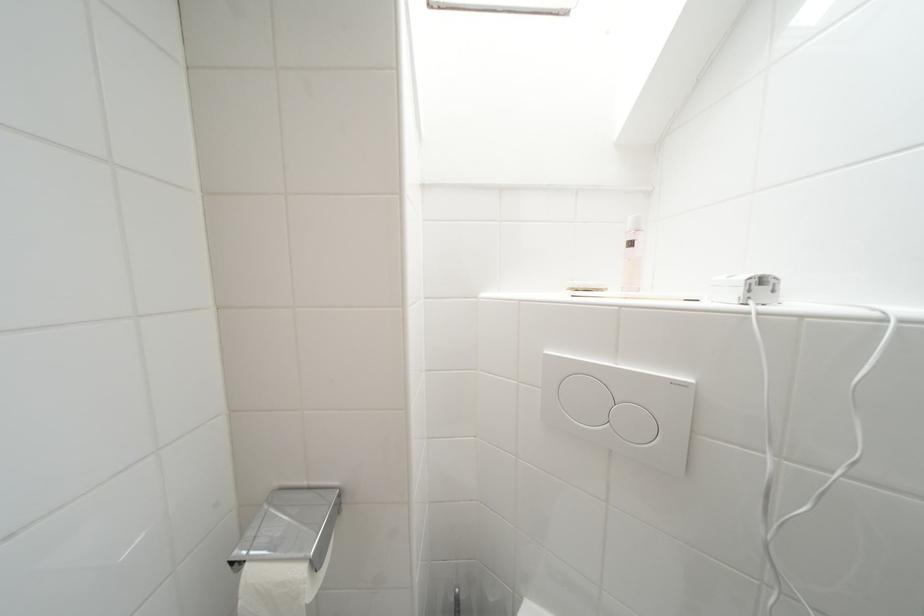
Find the location of a particular element. small toilet flush button is located at coordinates (633, 424).